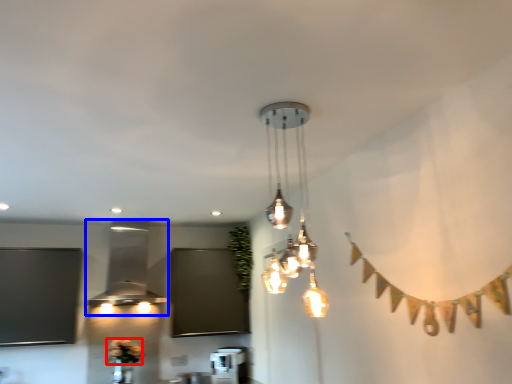
Question: Which object is further to the camera taking this photo, flower (highlighted by a red box) or lamp (highlighted by a blue box)?

Choices:
 (A) flower
 (B) lamp

Answer: (A)